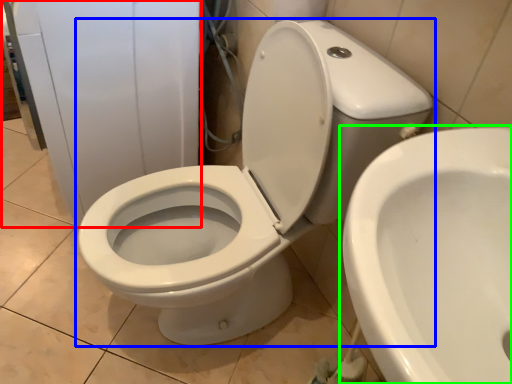
Question: Considering the real-world distances, which object is closest to porcelain (highlighted by a red box)? toilet (highlighted by a blue box) or toilet (highlighted by a green box).

Choices:
 (A) toilet
 (B) toilet

Answer: (A)